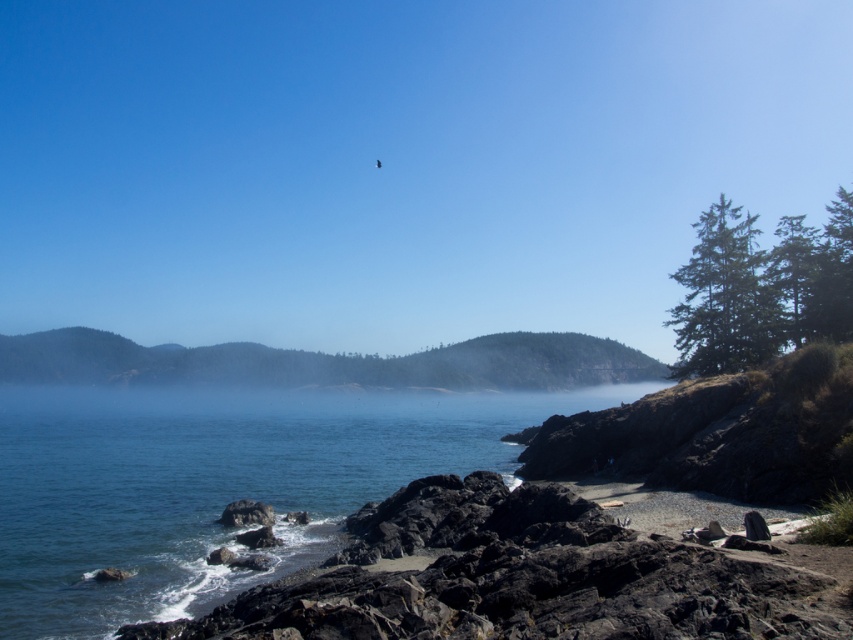
Is clear blue water at center closer to the viewer compared to volcanic rock beach at lower right?

No, it is behind volcanic rock beach at lower right.

What do you see at coordinates (215, 483) in the screenshot? The width and height of the screenshot is (853, 640). I see `clear blue water at center` at bounding box center [215, 483].

Between point (229, 388) and point (357, 509), which one is positioned in front?

Point (357, 509) is in front.

The height and width of the screenshot is (640, 853). What are the coordinates of `clear blue water at center` in the screenshot? It's located at (215, 483).